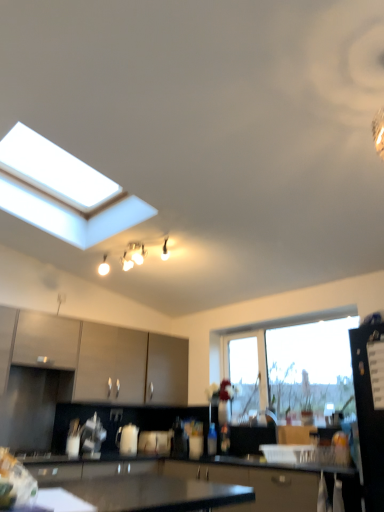
What is the approximate height of matte brown cabinet at left, acting as the first cabinetry starting from the left?

matte brown cabinet at left, acting as the first cabinetry starting from the left, is 49.59 centimeters tall.

Where is `matte brown cabinet at left, arranged as the 2th cabinetry when viewed from the right`? Image resolution: width=384 pixels, height=512 pixels. matte brown cabinet at left, arranged as the 2th cabinetry when viewed from the right is located at coordinates (46, 340).

At what (x,y) coordinates should I click in order to perform the action: click on white glossy kettle at center, which is the second appliance from right to left. Please return your answer as a coordinate pair (x, y). The width and height of the screenshot is (384, 512). Looking at the image, I should click on (127, 439).

Identify the location of matte gray cabinets at center, the second cabinetry viewed from the left. The image size is (384, 512). (97, 357).

This screenshot has height=512, width=384. Identify the location of transparent glass window at center. (308, 362).

From the image's perspective, would you say matte gray cabinets at center, the second cabinetry viewed from the left, is shown under transparent glass window at center?

Yes.

Is point (36, 321) farther from viewer compared to point (346, 324)?

No, it is not.

Consider the image. Is matte gray cabinets at center, which is the first cabinetry in right-to-left order, directly adjacent to transparent glass window at center?

No, matte gray cabinets at center, which is the first cabinetry in right-to-left order, is not next to transparent glass window at center.

Which is more to the right, matte gray cabinets at center, which is the first cabinetry in right-to-left order, or transparent glass window at center?

transparent glass window at center is more to the right.

What's the angular difference between matte brown cabinet at left, arranged as the 2th cabinetry when viewed from the right, and matte white light fixture at upper center's facing directions?

82.4 degrees separate the facing orientations of matte brown cabinet at left, arranged as the 2th cabinetry when viewed from the right, and matte white light fixture at upper center.

Would you say matte brown cabinet at left, arranged as the 2th cabinetry when viewed from the right, is inside or outside matte white light fixture at upper center?

matte brown cabinet at left, arranged as the 2th cabinetry when viewed from the right, is not inside matte white light fixture at upper center, it's outside.

From a real-world perspective, is matte brown cabinet at left, acting as the first cabinetry starting from the left, below matte white light fixture at upper center?

Indeed, from a real-world perspective, matte brown cabinet at left, acting as the first cabinetry starting from the left, is positioned beneath matte white light fixture at upper center.

Is matte brown cabinet at left, acting as the first cabinetry starting from the left, looking in the opposite direction of matte white light fixture at upper center?

matte brown cabinet at left, acting as the first cabinetry starting from the left, is not turned away from matte white light fixture at upper center.

Based on their sizes in the image, would you say white glossy kettle at center, which ranks as the 1th appliance in left-to-right order, is bigger or smaller than black glossy refrigerator at right, acting as the second appliance starting from the left?

white glossy kettle at center, which ranks as the 1th appliance in left-to-right order, is smaller than black glossy refrigerator at right, acting as the second appliance starting from the left.

From the picture: Considering the relative positions of white glossy kettle at center, which is the first appliance in back-to-front order, and black glossy refrigerator at right, placed as the 2th appliance when sorted from back to front, in the image provided, is white glossy kettle at center, which is the first appliance in back-to-front order, to the left of black glossy refrigerator at right, placed as the 2th appliance when sorted from back to front, from the viewer's perspective?

Yes.

Looking at this image, how different are the orientations of white glossy kettle at center, which is the second appliance from right to left, and black glossy refrigerator at right, placed as the 2th appliance when sorted from back to front, in degrees?

The angle between the facing direction of white glossy kettle at center, which is the second appliance from right to left, and the facing direction of black glossy refrigerator at right, placed as the 2th appliance when sorted from back to front, is 89.2 degrees.

Which object is closer to the camera, white glossy kettle at center, which is the second appliance from right to left, or black glossy refrigerator at right, the 1th appliance when ordered from right to left?

black glossy refrigerator at right, the 1th appliance when ordered from right to left.

Does transparent glass window at center have a lesser width compared to black glossy refrigerator at right, acting as the second appliance starting from the left?

Correct, the width of transparent glass window at center is less than that of black glossy refrigerator at right, acting as the second appliance starting from the left.

Is black glossy refrigerator at right, the first appliance in the top-to-bottom sequence, located within transparent glass window at center?

No, black glossy refrigerator at right, the first appliance in the top-to-bottom sequence, is not surrounded by transparent glass window at center.

Is transparent glass window at center closer to the viewer compared to black glossy refrigerator at right, the first appliance in the top-to-bottom sequence?

No, transparent glass window at center is further to the viewer.

From a real-world perspective, is transparent glass window at center over black glossy refrigerator at right, the 1th appliance when ordered from right to left?

Yes, from a real-world perspective, transparent glass window at center is over black glossy refrigerator at right, the 1th appliance when ordered from right to left

Considering the sizes of objects black glossy refrigerator at right, acting as the second appliance starting from the left, and white glossy kettle at center, which appears as the 1th appliance when ordered from the bottom, in the image provided, who is wider, black glossy refrigerator at right, acting as the second appliance starting from the left, or white glossy kettle at center, which appears as the 1th appliance when ordered from the bottom,?

black glossy refrigerator at right, acting as the second appliance starting from the left, is wider.

Based on their positions, is black glossy refrigerator at right, the 1th appliance from the front, located to the left or right of white glossy kettle at center, which is the second appliance from right to left?

From the image, it's evident that black glossy refrigerator at right, the 1th appliance from the front, is to the right of white glossy kettle at center, which is the second appliance from right to left.

I want to click on appliance on the left of black glossy refrigerator at right, placed as the 2th appliance when sorted from back to front, so click(127, 439).

Looking at this image, which of these two, black glossy refrigerator at right, which ranks as the 2th appliance in bottom-to-top order, or white glossy kettle at center, which is counted as the 2th appliance, starting from the front, is bigger?

black glossy refrigerator at right, which ranks as the 2th appliance in bottom-to-top order, is bigger.

From the image's perspective, would you say matte gray cabinets at center, the second cabinetry viewed from the left, is shown under white glossy kettle at center, which is the second appliance from right to left?

Incorrect, from the image's perspective, matte gray cabinets at center, the second cabinetry viewed from the left, is higher than white glossy kettle at center, which is the second appliance from right to left.

Does matte gray cabinets at center, which is the first cabinetry in right-to-left order, have a smaller size compared to white glossy kettle at center, the second appliance from the top?

Incorrect, matte gray cabinets at center, which is the first cabinetry in right-to-left order, is not smaller in size than white glossy kettle at center, the second appliance from the top.

Which point is more distant from viewer, (151, 368) or (118, 437)?

Positioned behind is point (151, 368).

From the picture: Could you tell me if matte gray cabinets at center, which is the first cabinetry in right-to-left order, is turned towards white glossy kettle at center, which is the second appliance from right to left?

No, matte gray cabinets at center, which is the first cabinetry in right-to-left order, is not oriented towards white glossy kettle at center, which is the second appliance from right to left.

Is black glossy refrigerator at right, placed as the 2th appliance when sorted from back to front, smaller than transparent glass window at center?

No.

Is point (378, 470) positioned in front of point (236, 402)?

Yes, it is.

Is black glossy refrigerator at right, the 1th appliance from the front, inside the boundaries of transparent glass window at center, or outside?

black glossy refrigerator at right, the 1th appliance from the front, cannot be found inside transparent glass window at center.

Measure the distance between black glossy refrigerator at right, the 1th appliance when ordered from right to left, and transparent glass window at center.

black glossy refrigerator at right, the 1th appliance when ordered from right to left, and transparent glass window at center are 1.20 meters apart.

Where is `window located above the matte gray cabinets at center, which is the first cabinetry in right-to-left order (from the image's perspective)`? window located above the matte gray cabinets at center, which is the first cabinetry in right-to-left order (from the image's perspective) is located at coordinates (308, 362).

Image resolution: width=384 pixels, height=512 pixels. I want to click on the 1st cabinetry below the matte white light fixture at upper center (from a real-world perspective), so click(46, 340).

Looking at the image, which one is located closer to black glossy refrigerator at right, the 1th appliance when ordered from right to left, matte brown cabinet at left, arranged as the 2th cabinetry when viewed from the right, or matte gray cabinets at center, the second cabinetry viewed from the left?

Among the two, matte gray cabinets at center, the second cabinetry viewed from the left, is located nearer to black glossy refrigerator at right, the 1th appliance when ordered from right to left.

Estimate the real-world distances between objects in this image. Which object is closer to transparent glass window at center, matte brown cabinet at left, acting as the first cabinetry starting from the left, or matte gray cabinets at center, which is the first cabinetry in right-to-left order?

matte gray cabinets at center, which is the first cabinetry in right-to-left order.

Considering their positions, is matte gray cabinets at center, which is the first cabinetry in right-to-left order, positioned further to matte brown cabinet at left, acting as the first cabinetry starting from the left, than black glossy refrigerator at right, the first appliance in the top-to-bottom sequence?

The object further to matte brown cabinet at left, acting as the first cabinetry starting from the left, is black glossy refrigerator at right, the first appliance in the top-to-bottom sequence.

Consider the image. Looking at the image, which one is located closer to matte brown cabinet at left, acting as the first cabinetry starting from the left, matte gray cabinets at center, which is the first cabinetry in right-to-left order, or transparent glass window at center?

matte gray cabinets at center, which is the first cabinetry in right-to-left order, is closer to matte brown cabinet at left, acting as the first cabinetry starting from the left.

Considering their positions, is matte brown cabinet at left, acting as the first cabinetry starting from the left, positioned closer to black glossy refrigerator at right, the 1th appliance when ordered from right to left, than transparent glass window at center?

transparent glass window at center is closer to black glossy refrigerator at right, the 1th appliance when ordered from right to left.

Based on their spatial positions, is black glossy refrigerator at right, which ranks as the 2th appliance in bottom-to-top order, or transparent glass window at center further from matte gray cabinets at center, the second cabinetry viewed from the left?

black glossy refrigerator at right, which ranks as the 2th appliance in bottom-to-top order, is positioned further to the anchor matte gray cabinets at center, the second cabinetry viewed from the left.

When comparing their distances from white glossy kettle at center, which appears as the 1th appliance when ordered from the bottom, does matte white light fixture at upper center or matte gray cabinets at center, which is the first cabinetry in right-to-left order, seem further?

matte white light fixture at upper center is positioned further to the anchor white glossy kettle at center, which appears as the 1th appliance when ordered from the bottom.

Based on their spatial positions, is white glossy kettle at center, which appears as the 1th appliance when ordered from the bottom, or matte gray cabinets at center, the second cabinetry viewed from the left, further from matte brown cabinet at left, acting as the first cabinetry starting from the left?

white glossy kettle at center, which appears as the 1th appliance when ordered from the bottom, lies further to matte brown cabinet at left, acting as the first cabinetry starting from the left, than the other object.

The image size is (384, 512). Identify the location of cabinetry between matte brown cabinet at left, acting as the first cabinetry starting from the left, and white glossy kettle at center, which is counted as the 2th appliance, starting from the front, from top to bottom. (97, 357).

This screenshot has width=384, height=512. In order to click on light fixture between matte brown cabinet at left, arranged as the 2th cabinetry when viewed from the right, and black glossy refrigerator at right, the 1th appliance when ordered from right to left, from left to right in this screenshot , I will do `click(133, 255)`.

You are a GUI agent. You are given a task and a screenshot of the screen. Output one action in this format:
    pyautogui.click(x=<x>, y=<y>)
    Task: Click on the cabinetry between matte white light fixture at upper center and matte gray cabinets at center, which is the first cabinetry in right-to-left order, from top to bottom
    The height and width of the screenshot is (512, 384).
    Given the screenshot: What is the action you would take?
    pyautogui.click(x=46, y=340)

This screenshot has width=384, height=512. Identify the location of cabinetry located between matte brown cabinet at left, arranged as the 2th cabinetry when viewed from the right, and black glossy refrigerator at right, the first appliance in the top-to-bottom sequence, in the left-right direction. (97, 357).